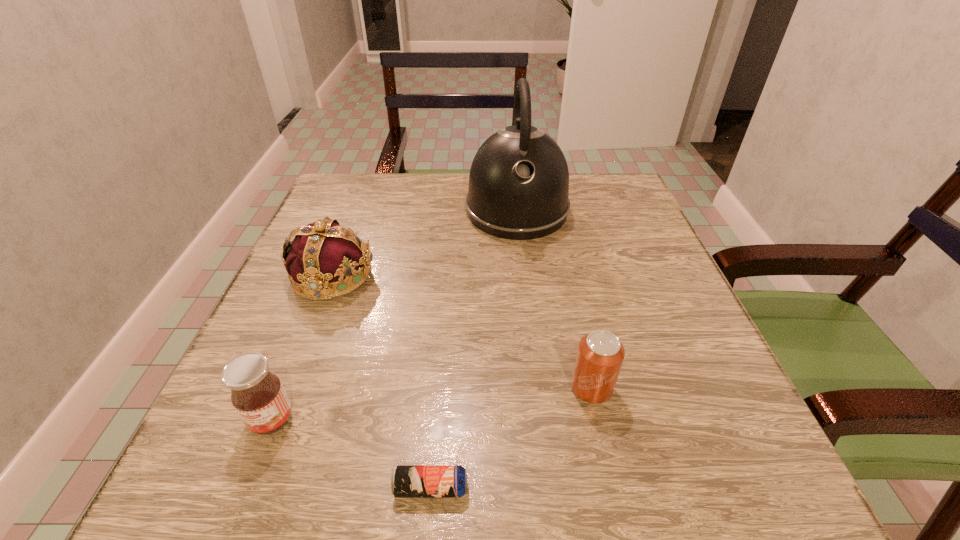
You are a GUI agent. You are given a task and a screenshot of the screen. Output one action in this format:
    pyautogui.click(x=<x>, y=<y>)
    Task: Click on the vacant area situated 0.090m on the back of the can
    The image size is (960, 540).
    Given the screenshot: What is the action you would take?
    pyautogui.click(x=578, y=330)

Where is `free space located on the left of the shortest object`? free space located on the left of the shortest object is located at coordinates (303, 488).

This screenshot has width=960, height=540. Identify the location of object that is positioned at the far edge. (518, 189).

You are a GUI agent. You are given a task and a screenshot of the screen. Output one action in this format:
    pyautogui.click(x=<x>, y=<y>)
    Task: Click on the object situated at the near edge
    
    Given the screenshot: What is the action you would take?
    pyautogui.click(x=408, y=481)

Find the location of a particular element. The height and width of the screenshot is (540, 960). crown situated at the left edge is located at coordinates (323, 253).

The height and width of the screenshot is (540, 960). I want to click on jam that is positioned at the left edge, so click(257, 394).

Locate an element on the screen. The width and height of the screenshot is (960, 540). free space at the near edge of the desktop is located at coordinates (541, 458).

In the image, there is a desktop. In order to click on vacant space at the left edge in this screenshot , I will do `click(272, 435)`.

Find the location of a particular element. vacant space at the right edge of the desktop is located at coordinates (692, 374).

Find the location of `vacant space at the far left corner of the desktop`. vacant space at the far left corner of the desktop is located at coordinates (375, 195).